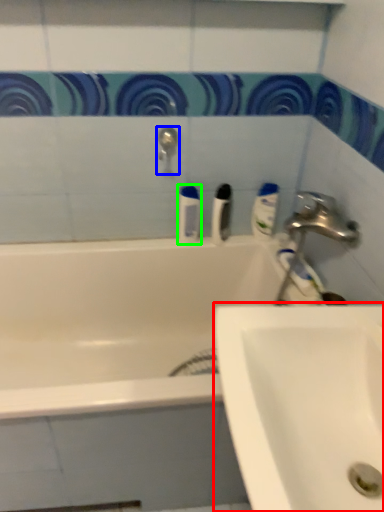
Question: Which is nearer to the sink (highlighted by a red box)? tap (highlighted by a blue box) or mouthwash (highlighted by a green box).

Choices:
 (A) tap
 (B) mouthwash

Answer: (B)